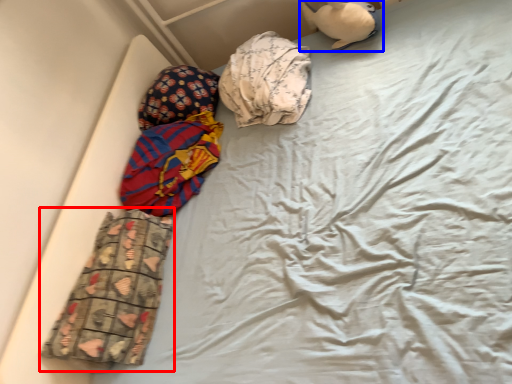
Question: Which object is closer to the camera taking this photo, material (highlighted by a red box) or toy (highlighted by a blue box)?

Choices:
 (A) material
 (B) toy

Answer: (A)